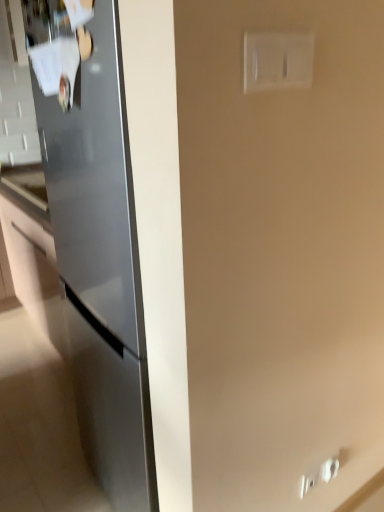
Find the location of `white plastic switch at upper right`. white plastic switch at upper right is located at coordinates click(278, 60).

Measure the distance between point (284, 78) and camera.

The distance of point (284, 78) from camera is 27.95 inches.

The image size is (384, 512). What do you see at coordinates (278, 60) in the screenshot?
I see `white plastic switch at upper right` at bounding box center [278, 60].

The image size is (384, 512). What do you see at coordinates (101, 265) in the screenshot?
I see `sleek metallic refrigerator at left` at bounding box center [101, 265].

In order to face sleek metallic refrigerator at left, should I rotate leftwards or rightwards?

A 7.599 degree turn to the left will do.

At what (x,y) coordinates should I click in order to perform the action: click on sleek metallic refrigerator at left. Please return your answer as a coordinate pair (x, y). Looking at the image, I should click on (101, 265).

At what (x,y) coordinates should I click in order to perform the action: click on white plastic switch at upper right. Please return your answer as a coordinate pair (x, y). The image size is (384, 512). Looking at the image, I should click on (278, 60).

Is white plastic switch at upper right to the left of sleek metallic refrigerator at left from the viewer's perspective?

In fact, white plastic switch at upper right is to the right of sleek metallic refrigerator at left.

Relative to sleek metallic refrigerator at left, is white plastic switch at upper right in front or behind?

Clearly, white plastic switch at upper right is in front of sleek metallic refrigerator at left.

Considering the points (302, 42) and (105, 201), which point is behind, point (302, 42) or point (105, 201)?

The point (105, 201) is behind.

From the image's perspective, who appears lower, white plastic switch at upper right or sleek metallic refrigerator at left?

From the image's view, sleek metallic refrigerator at left is below.

From a real-world perspective, which is physically below, white plastic switch at upper right or sleek metallic refrigerator at left?

sleek metallic refrigerator at left.

Is white plastic switch at upper right thinner than sleek metallic refrigerator at left?

Yes, white plastic switch at upper right is thinner than sleek metallic refrigerator at left.

Which of these two, white plastic switch at upper right or sleek metallic refrigerator at left, stands taller?

Standing taller between the two is sleek metallic refrigerator at left.

Who is bigger, white plastic switch at upper right or sleek metallic refrigerator at left?

sleek metallic refrigerator at left is bigger.

Could sleek metallic refrigerator at left be considered to be inside white plastic switch at upper right?

That's incorrect, sleek metallic refrigerator at left is not inside white plastic switch at upper right.

Is white plastic switch at upper right next to sleek metallic refrigerator at left?

They are not placed beside each other.

Is white plastic switch at upper right looking in the opposite direction of sleek metallic refrigerator at left?

That's right, white plastic switch at upper right is facing away from sleek metallic refrigerator at left.

Can you tell me how much white plastic switch at upper right and sleek metallic refrigerator at left differ in facing direction?

The angle between the facing direction of white plastic switch at upper right and the facing direction of sleek metallic refrigerator at left is 89.5 degrees.

From the picture: How distant is white plastic switch at upper right from sleek metallic refrigerator at left?

white plastic switch at upper right and sleek metallic refrigerator at left are 29.21 inches apart from each other.

Locate an element on the screen. Image resolution: width=384 pixels, height=512 pixels. electric outlet above the sleek metallic refrigerator at left (from the image's perspective) is located at coordinates (278, 60).

Does sleek metallic refrigerator at left appear on the right side of white plastic switch at upper right?

No.

Which object is further away from the camera taking this photo, sleek metallic refrigerator at left or white plastic switch at upper right?

sleek metallic refrigerator at left is behind.

Based on the photo, which is farther from the camera, (x=97, y=83) or (x=293, y=56)?

The point (x=97, y=83) is behind.

From the image's perspective, is sleek metallic refrigerator at left located above white plastic switch at upper right?

No, from the image's perspective, sleek metallic refrigerator at left is not on top of white plastic switch at upper right.

From a real-world perspective, is sleek metallic refrigerator at left over white plastic switch at upper right?

Incorrect, from a real-world perspective, sleek metallic refrigerator at left is lower than white plastic switch at upper right.

In terms of width, does sleek metallic refrigerator at left look wider or thinner when compared to white plastic switch at upper right?

In the image, sleek metallic refrigerator at left appears to be wider than white plastic switch at upper right.

Considering the sizes of sleek metallic refrigerator at left and white plastic switch at upper right in the image, is sleek metallic refrigerator at left taller or shorter than white plastic switch at upper right?

Considering their sizes, sleek metallic refrigerator at left has more height than white plastic switch at upper right.

In the scene shown: Can you confirm if sleek metallic refrigerator at left is bigger than white plastic switch at upper right?

Correct, sleek metallic refrigerator at left is larger in size than white plastic switch at upper right.

Can we say sleek metallic refrigerator at left lies outside white plastic switch at upper right?

Yes.

Is the surface of sleek metallic refrigerator at left in direct contact with white plastic switch at upper right?

No.

In the scene shown: Is white plastic switch at upper right at the back of sleek metallic refrigerator at left?

sleek metallic refrigerator at left does not have its back to white plastic switch at upper right.

What are the coordinates of `refrigerator below the white plastic switch at upper right (from the image's perspective)` in the screenshot? It's located at (101, 265).

Where is `electric outlet positioned vertically above the sleek metallic refrigerator at left (from a real-world perspective)`? Image resolution: width=384 pixels, height=512 pixels. electric outlet positioned vertically above the sleek metallic refrigerator at left (from a real-world perspective) is located at coordinates (278, 60).

The image size is (384, 512). Find the location of `refrigerator beneath the white plastic switch at upper right (from a real-world perspective)`. refrigerator beneath the white plastic switch at upper right (from a real-world perspective) is located at coordinates (101, 265).